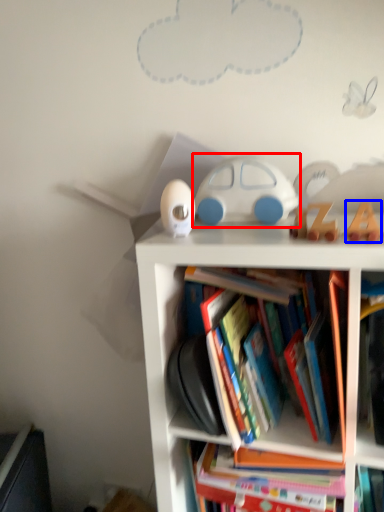
Question: Among these objects, which one is farthest to the camera, toy (highlighted by a red box) or toy (highlighted by a blue box)?

Choices:
 (A) toy
 (B) toy

Answer: (A)